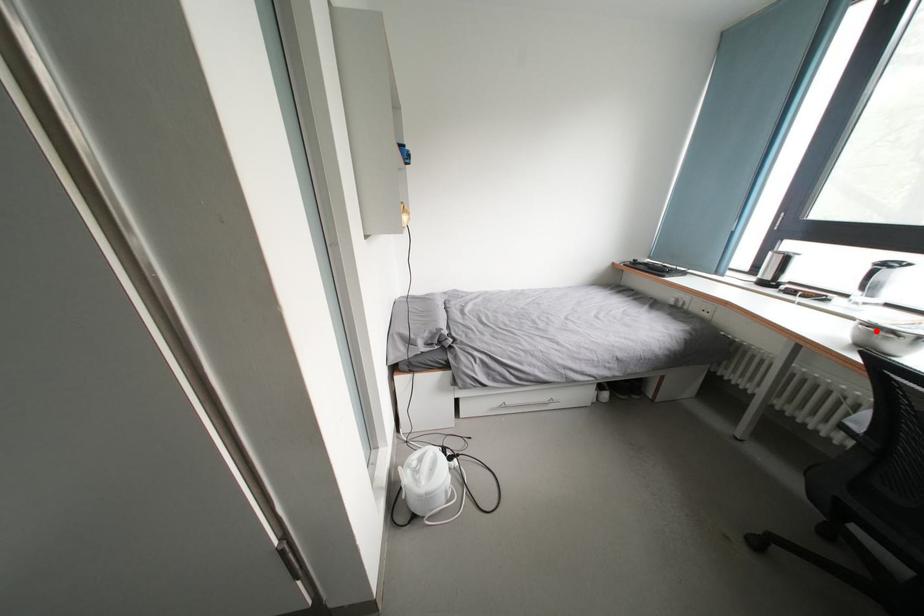
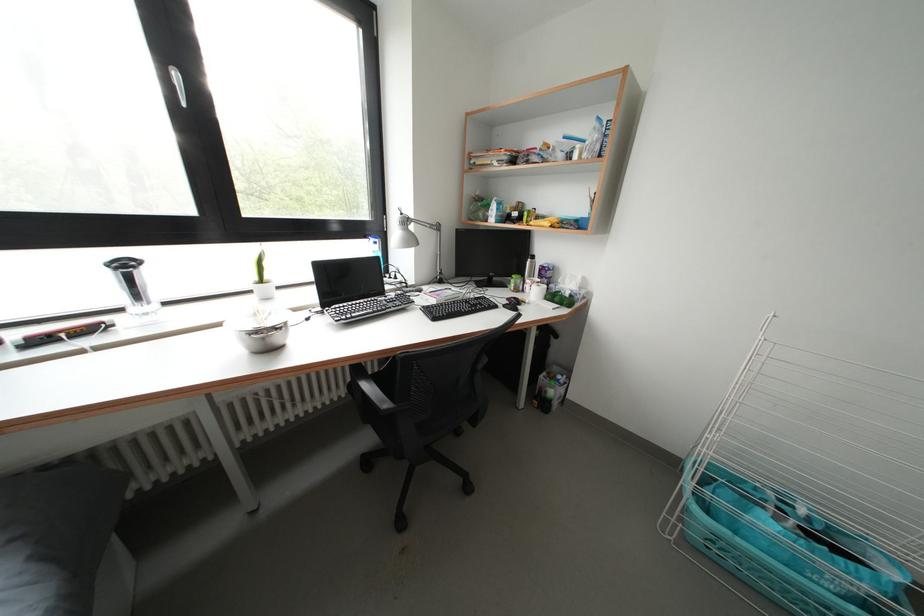
Find the pixel in the second image that matches the highlighted location in the first image.

(262, 337)